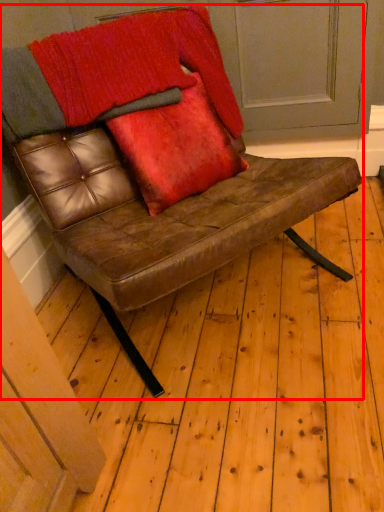
Question: From the image's perspective, what is the correct spatial positioning of chair (annotated by the red box) in reference to throw pillow?

Choices:
 (A) above
 (B) below

Answer: (B)